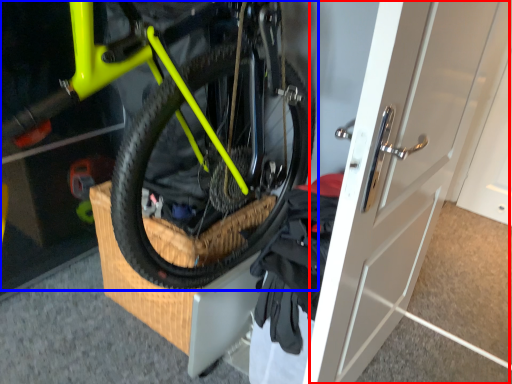
Question: Which object is closer to the camera taking this photo, door (highlighted by a red box) or bicycle (highlighted by a blue box)?

Choices:
 (A) door
 (B) bicycle

Answer: (B)